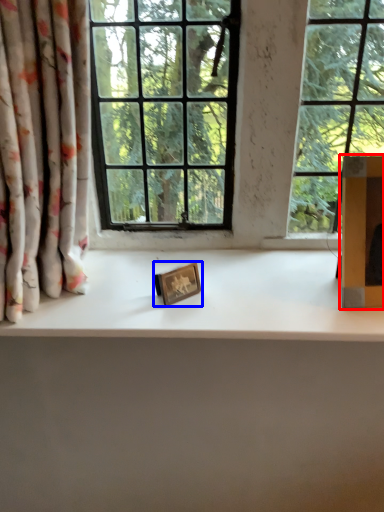
Question: Which object is closer to the camera taking this photo, cardboard box (highlighted by a red box) or picture frame (highlighted by a blue box)?

Choices:
 (A) cardboard box
 (B) picture frame

Answer: (A)